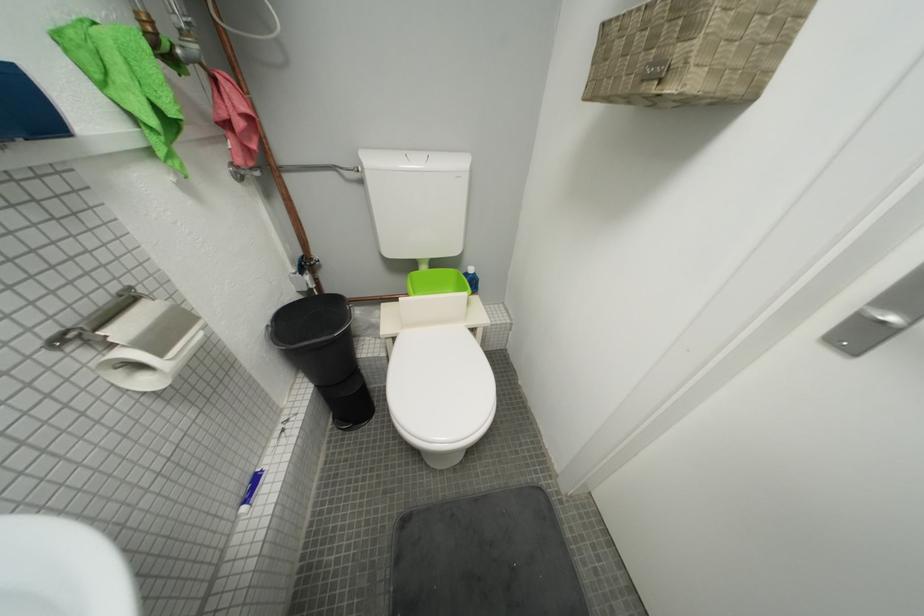
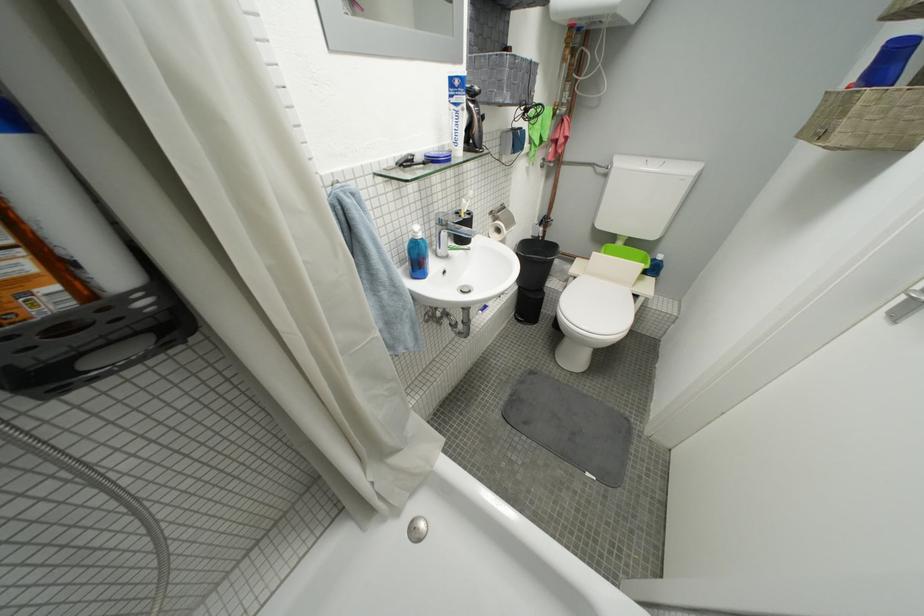
In the second image, find the point that corresponds to [65,342] in the first image.

(500, 214)